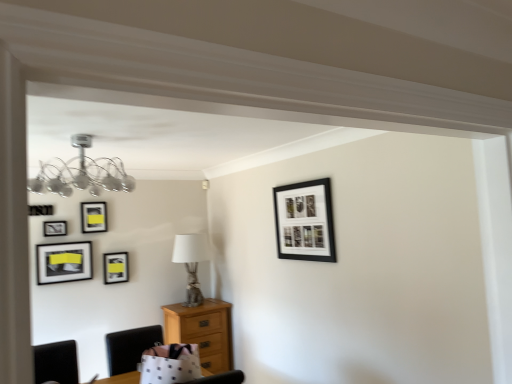
Find the location of a particular element. This screenshot has width=512, height=384. chrome metallic chandelier at upper left is located at coordinates (82, 173).

What is the approximate height of light brown wooden chest of drawers at lower left?

light brown wooden chest of drawers at lower left is 29.30 inches in height.

What do you see at coordinates (64, 262) in the screenshot? I see `matte black picture frame at left, placed as the 4th picture frame when sorted from right to left` at bounding box center [64, 262].

What do you see at coordinates (305, 221) in the screenshot?
I see `matte black picture frame at upper right, the first picture frame viewed from the front` at bounding box center [305, 221].

This screenshot has width=512, height=384. Identify the location of white fabric lampshade at center. (191, 263).

This screenshot has width=512, height=384. In order to click on chrome metallic chandelier at upper left in this screenshot , I will do `click(82, 173)`.

Is matte black picture frame at upper right, the first picture frame viewed from the front, positioned in front of black leather chair at lower left?

Yes, matte black picture frame at upper right, the first picture frame viewed from the front, is in front of black leather chair at lower left.

Which of these two, matte black picture frame at upper right, the 1th picture frame in the right-to-left sequence, or black leather chair at lower left, is bigger?

black leather chair at lower left.

Is matte black picture frame at upper right, the 1th picture frame in the right-to-left sequence, spatially inside black leather chair at lower left, or outside of it?

matte black picture frame at upper right, the 1th picture frame in the right-to-left sequence, lies outside black leather chair at lower left.

From a real-world perspective, which picture frame is the 3rd one above the black leather chair at lower left? Please provide its 2D coordinates.

[(305, 221)]

This screenshot has height=384, width=512. Find the location of `picture frame that is the 2nd one when counting backward from the matte black picture frame at upper left, which is the third picture frame in back-to-front order`. picture frame that is the 2nd one when counting backward from the matte black picture frame at upper left, which is the third picture frame in back-to-front order is located at coordinates (116, 267).

How different are the orientations of matte black picture frame at upper left, which is counted as the fifth picture frame, starting from the front, and matte black picture frame at upper left, which is the third picture frame in back-to-front order, in degrees?

They differ by 0.00018 degrees in their facing directions.

Would you consider matte black picture frame at upper left, the 4th picture frame positioned from the left, to be distant from matte black picture frame at upper left, which is the third picture frame in back-to-front order?

No, matte black picture frame at upper left, the 4th picture frame positioned from the left, is not far from matte black picture frame at upper left, which is the third picture frame in back-to-front order.

From the picture: Is matte black picture frame at upper left, placed as the 2th picture frame when sorted from right to left, positioned behind matte black picture frame at upper left, which is the third picture frame in back-to-front order?

Yes, it is.

From a real-world perspective, which is physically above, matte black picture frame at upper left, positioned as the third picture frame in right-to-left order, or matte black picture frame at upper right, the 1th picture frame in the right-to-left sequence?

matte black picture frame at upper left, positioned as the third picture frame in right-to-left order.

Between point (91, 224) and point (285, 234), which one is positioned in front?

Positioned in front is point (285, 234).

Is matte black picture frame at upper left, which is the 3th picture frame in left-to-right order, at the left side of matte black picture frame at upper right, the first picture frame viewed from the front?

Correct, you'll find matte black picture frame at upper left, which is the 3th picture frame in left-to-right order, to the left of matte black picture frame at upper right, the first picture frame viewed from the front.

Which object is thinner, matte black picture frame at upper left, which is counted as the fifth picture frame, starting from the front, or chrome metallic chandelier at upper left?

Thinner between the two is matte black picture frame at upper left, which is counted as the fifth picture frame, starting from the front.

Are matte black picture frame at upper left, the 4th picture frame positioned from the left, and chrome metallic chandelier at upper left making contact?

No, matte black picture frame at upper left, the 4th picture frame positioned from the left, is not next to chrome metallic chandelier at upper left.

Where is `lamp on the right side of matte black picture frame at upper left, placed as the 2th picture frame when sorted from right to left`? The height and width of the screenshot is (384, 512). lamp on the right side of matte black picture frame at upper left, placed as the 2th picture frame when sorted from right to left is located at coordinates (82, 173).

Does point (106, 261) appear closer or farther from the camera than point (37, 185)?

Point (106, 261) appears to be farther away from the viewer than point (37, 185).

From the image's perspective, is white fabric lampshade at center above or below matte black picture frame at upper left, the 1th picture frame in the back-to-front sequence?

Based on their image positions, white fabric lampshade at center is located beneath matte black picture frame at upper left, the 1th picture frame in the back-to-front sequence.

Considering the sizes of objects white fabric lampshade at center and matte black picture frame at upper left, which is counted as the fifth picture frame, starting from the front, in the image provided, who is smaller, white fabric lampshade at center or matte black picture frame at upper left, which is counted as the fifth picture frame, starting from the front,?

With smaller size is matte black picture frame at upper left, which is counted as the fifth picture frame, starting from the front.

Between white fabric lampshade at center and matte black picture frame at upper left, the 4th picture frame positioned from the left, which one has larger width?

white fabric lampshade at center.

Based on the photo, is white fabric lampshade at center far from matte black picture frame at upper left, the 1th picture frame in the back-to-front sequence?

white fabric lampshade at center is actually quite close to matte black picture frame at upper left, the 1th picture frame in the back-to-front sequence.

In the scene shown: In terms of height, does black leather chair at lower left look taller or shorter compared to matte black picture frame at left, acting as the second picture frame starting from the left?

black leather chair at lower left is shorter than matte black picture frame at left, acting as the second picture frame starting from the left.

From the picture: Can you tell me how much black leather chair at lower left and matte black picture frame at left, placed as the 4th picture frame when sorted from right to left, differ in facing direction?

They differ by 0.714 degrees in their facing directions.

Is black leather chair at lower left at the left side of matte black picture frame at left, acting as the second picture frame starting from the left?

Incorrect, black leather chair at lower left is not on the left side of matte black picture frame at left, acting as the second picture frame starting from the left.

Is black leather chair at lower left in contact with matte black picture frame at left, positioned as the 2th picture frame in front-to-back order?

black leather chair at lower left is not next to matte black picture frame at left, positioned as the 2th picture frame in front-to-back order, and they're not touching.

Is the depth of light brown wooden chest of drawers at lower left greater than that of black leather chair at lower left?

That is True.

Which of these two, light brown wooden chest of drawers at lower left or black leather chair at lower left, is bigger?

light brown wooden chest of drawers at lower left.

Would you say light brown wooden chest of drawers at lower left is a long distance from black leather chair at lower left?

Actually, light brown wooden chest of drawers at lower left and black leather chair at lower left are a little close together.

Is black leather chair at lower left at the back of light brown wooden chest of drawers at lower left?

No, light brown wooden chest of drawers at lower left's orientation is not away from black leather chair at lower left.

At what (x,y) coordinates should I click in order to perform the action: click on chair directly beneath the matte black picture frame at upper right, the 5th picture frame in the left-to-right sequence (from a real-world perspective). Please return your answer as a coordinate pair (x, y). The image size is (512, 384). Looking at the image, I should click on (130, 347).

The width and height of the screenshot is (512, 384). Identify the location of picture frame that is the 3rd object to the left of the matte black picture frame at upper left, which is counted as the fifth picture frame, starting from the front, starting at the anchor. (54, 228).

From the image, which object appears to be nearer to chrome metallic chandelier at upper left, matte black picture frame at upper left, the 4th picture frame positioned from the left, or matte black picture frame at upper right, the 5th picture frame in the left-to-right sequence?

Based on the image, matte black picture frame at upper left, the 4th picture frame positioned from the left, appears to be nearer to chrome metallic chandelier at upper left.

Based on their spatial positions, is matte black picture frame at upper left, placed as the 2th picture frame when sorted from right to left, or matte black picture frame at left, positioned as the 2th picture frame in front-to-back order, closer to light brown wooden chest of drawers at lower left?

matte black picture frame at upper left, placed as the 2th picture frame when sorted from right to left, is positioned closer to the anchor light brown wooden chest of drawers at lower left.

Estimate the real-world distances between objects in this image. Which object is further from matte black picture frame at upper left, which is the 3th picture frame in left-to-right order, matte black picture frame at upper left, which is the third picture frame in back-to-front order, or black leather chair at lower left?

black leather chair at lower left is positioned further to the anchor matte black picture frame at upper left, which is the 3th picture frame in left-to-right order.

Looking at the image, which one is located further to black leather chair at lower left, chrome metallic chandelier at upper left or matte black picture frame at upper right, the 1th picture frame in the right-to-left sequence?

matte black picture frame at upper right, the 1th picture frame in the right-to-left sequence, is further to black leather chair at lower left.

In the scene shown: Looking at the image, which one is located closer to black leather chair at lower left, matte black picture frame at left, positioned as the 2th picture frame in front-to-back order, or light brown wooden chest of drawers at lower left?

The object closer to black leather chair at lower left is light brown wooden chest of drawers at lower left.

Considering their positions, is matte black picture frame at left, positioned as the fourth picture frame in back-to-front order, positioned further to chrome metallic chandelier at upper left than white fabric lampshade at center?

Based on the image, white fabric lampshade at center appears to be further to chrome metallic chandelier at upper left.

From the image, which object appears to be farther from white fabric lampshade at center, black leather chair at lower left or matte black picture frame at left, acting as the second picture frame starting from the left?

matte black picture frame at left, acting as the second picture frame starting from the left.

Considering their positions, is chrome metallic chandelier at upper left positioned closer to matte black picture frame at upper right, positioned as the fifth picture frame in back-to-front order, than white fabric lampshade at center?

Based on the image, chrome metallic chandelier at upper left appears to be nearer to matte black picture frame at upper right, positioned as the fifth picture frame in back-to-front order.

You are a GUI agent. You are given a task and a screenshot of the screen. Output one action in this format:
    pyautogui.click(x=<x>, y=<y>)
    Task: Click on the chair positioned between chrome metallic chandelier at upper left and matte black picture frame at upper left, the 1th picture frame from the left, from near to far
    
    Given the screenshot: What is the action you would take?
    pyautogui.click(x=130, y=347)

This screenshot has height=384, width=512. What are the coordinates of `table lamp between matte black picture frame at upper left, the 1th picture frame in the back-to-front sequence, and light brown wooden chest of drawers at lower left vertically` in the screenshot? It's located at (191, 263).

The image size is (512, 384). What are the coordinates of `chair between chrome metallic chandelier at upper left and matte black picture frame at left, placed as the 4th picture frame when sorted from right to left, from front to back` in the screenshot? It's located at (130, 347).

At what (x,y) coordinates should I click in order to perform the action: click on chair between matte black picture frame at upper left, which ranks as the 2th picture frame in back-to-front order, and light brown wooden chest of drawers at lower left from top to bottom. Please return your answer as a coordinate pair (x, y). This screenshot has height=384, width=512. Looking at the image, I should click on (130, 347).